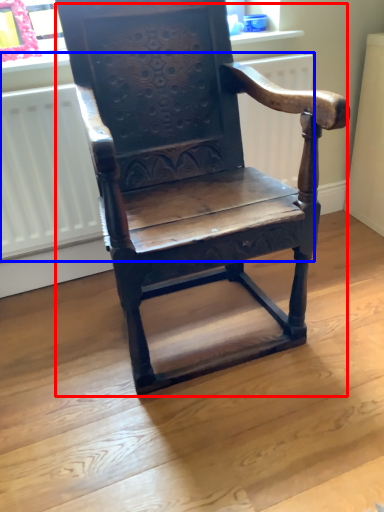
Question: Which object appears closest to the camera in this image, chair (highlighted by a red box) or radiator (highlighted by a blue box)?

Choices:
 (A) chair
 (B) radiator

Answer: (A)